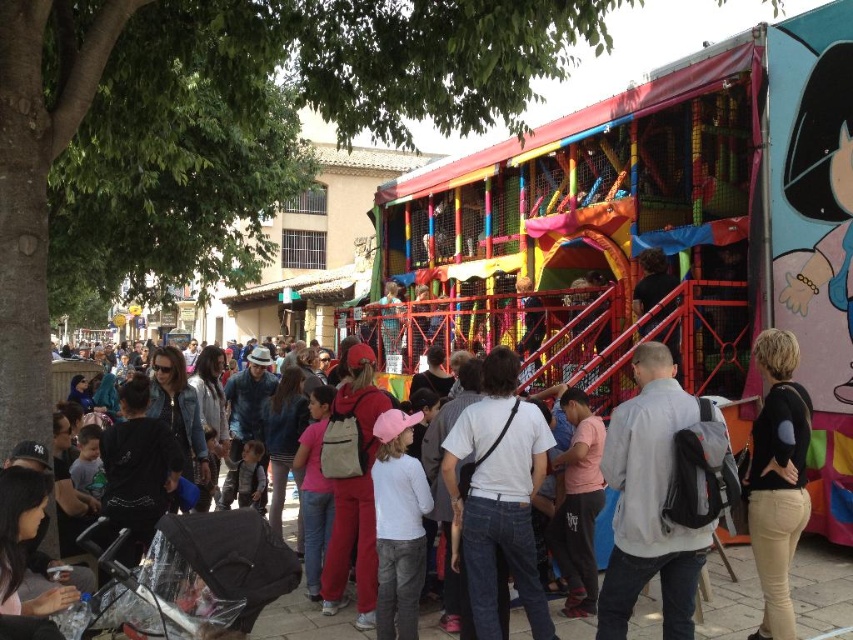
You are standing at the fair and want to take a photo of the play structure. You notice two points on the structure labeled as point (693, 577) and point (527, 509). Which point will appear larger in your photo?

Point (693, 577) will appear larger in the photo because it is closer to the camera than point (527, 509).

You are standing at the center of the fairground and see the multicolored plastic playhouse at center and the white matte shirt at center. If you want to reach the playhouse first, which direction should you walk towards?

The multicolored plastic playhouse at center is 19.67 meters away from the white matte shirt at center. Since you are at the center, you need to walk towards the playhouse to reach it first.

You are a photographer standing at the edge of the fairground. You want to take a photo of the white matte shirt at center without the multicolored plastic playhouse at center blocking it. Is this possible?

The multicolored plastic playhouse at center is positioned over the white matte shirt at center, so it will block the view. You cannot take a photo of the white matte shirt at center without the playhouse blocking it.